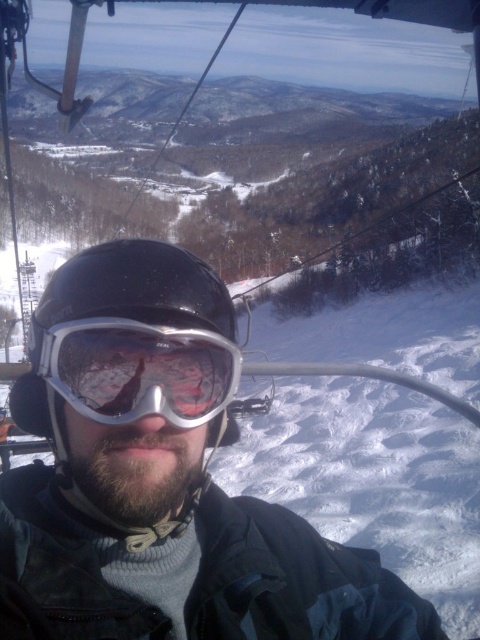
Question: Which of these objects is positioned farthest from the black matte helmet at center?

Choices:
 (A) matte silver goggles at center
 (B) matte black helmet at center

Answer: (B)

Question: Is matte black helmet at center thinner than black matte helmet at center?

Choices:
 (A) no
 (B) yes

Answer: (A)

Question: Is the position of black matte helmet at center more distant than that of matte silver goggles at center?

Choices:
 (A) yes
 (B) no

Answer: (A)

Question: Which of these objects is positioned closest to the matte black helmet at center?

Choices:
 (A) matte silver goggles at center
 (B) black matte helmet at center

Answer: (A)

Question: Can you confirm if black matte helmet at center is thinner than matte silver goggles at center?

Choices:
 (A) yes
 (B) no

Answer: (B)

Question: Which object appears closest to the camera in this image?

Choices:
 (A) black matte helmet at center
 (B) matte silver goggles at center

Answer: (B)